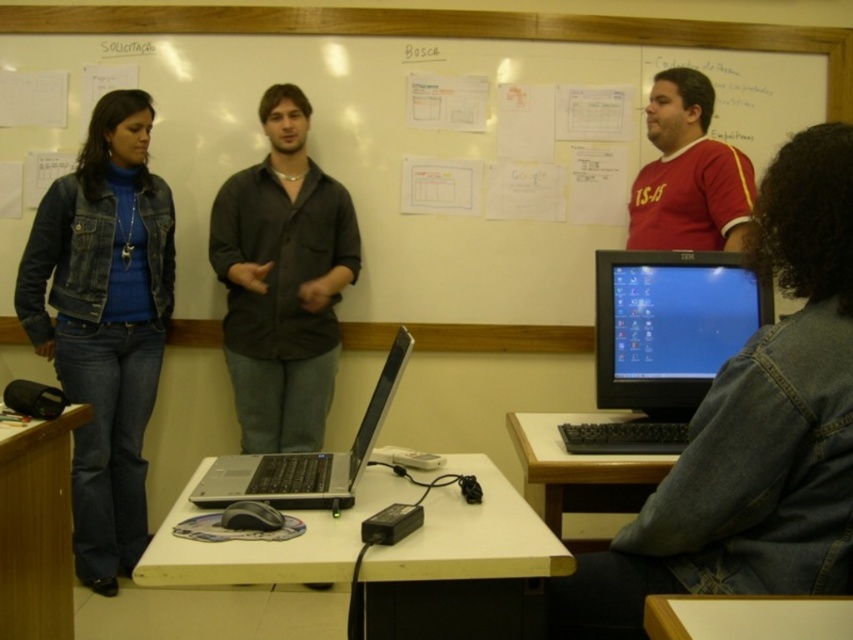
Question: Which of the following is the farthest from the observer?

Choices:
 (A) (546, 340)
 (B) (22, 488)

Answer: (A)

Question: Where is matte black monitor at right located in relation to silver metallic laptop at center in the image?

Choices:
 (A) left
 (B) right

Answer: (B)

Question: Is whiteboard at upper center behind matte red shirt at upper right?

Choices:
 (A) yes
 (B) no

Answer: (A)

Question: Which object is positioned farthest from the matte black monitor at right?

Choices:
 (A) matte red shirt at upper right
 (B) silver metallic laptop at center
 (C) denim jacket at left

Answer: (C)

Question: Is matte black monitor at right to the left of matte red shirt at upper right from the viewer's perspective?

Choices:
 (A) no
 (B) yes

Answer: (B)

Question: Based on their relative distances, which object is farther from the denim jacket at left?

Choices:
 (A) matte red shirt at upper right
 (B) whiteboard at upper center
 (C) silver metallic laptop at center
 (D) denim jacket at lower right

Answer: (D)